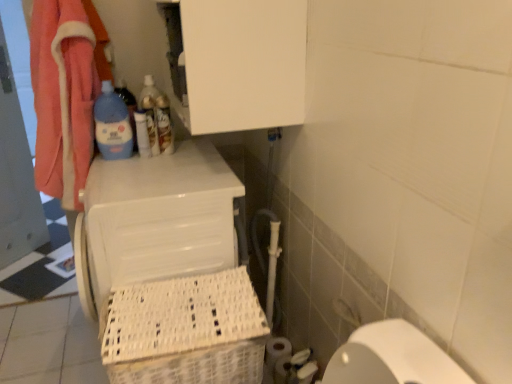
Question: Is white plastic basket at lower left in front of white plastic laundry basket at lower left?

Choices:
 (A) yes
 (B) no

Answer: (A)

Question: Could white plastic laundry basket at lower left be considered to be inside white plastic basket at lower left?

Choices:
 (A) no
 (B) yes

Answer: (A)

Question: Does white plastic basket at lower left turn towards white plastic laundry basket at lower left?

Choices:
 (A) no
 (B) yes

Answer: (A)

Question: Can you confirm if white plastic basket at lower left is shorter than white plastic laundry basket at lower left?

Choices:
 (A) no
 (B) yes

Answer: (B)

Question: Can you confirm if white plastic basket at lower left is positioned to the right of white plastic laundry basket at lower left?

Choices:
 (A) yes
 (B) no

Answer: (A)

Question: Is white plastic basket at lower left far from white plastic laundry basket at lower left?

Choices:
 (A) no
 (B) yes

Answer: (A)

Question: Does translucent plastic bottle at upper center, the 3th bottle in the left-to-right sequence, have a lesser width compared to white plastic laundry basket at lower left?

Choices:
 (A) no
 (B) yes

Answer: (B)

Question: Is translucent plastic bottle at upper center, positioned as the first bottle in right-to-left order, smaller than white plastic laundry basket at lower left?

Choices:
 (A) no
 (B) yes

Answer: (B)

Question: Can white plastic laundry basket at lower left be found inside translucent plastic bottle at upper center, the 3th bottle in the left-to-right sequence?

Choices:
 (A) no
 (B) yes

Answer: (A)

Question: Is translucent plastic bottle at upper center, positioned as the first bottle in right-to-left order, not close to white plastic laundry basket at lower left?

Choices:
 (A) no
 (B) yes

Answer: (A)

Question: Can you confirm if translucent plastic bottle at upper center, positioned as the first bottle in right-to-left order, is bigger than white plastic laundry basket at lower left?

Choices:
 (A) yes
 (B) no

Answer: (B)

Question: Does translucent plastic bottle at upper center, positioned as the first bottle in right-to-left order, have a greater height compared to white plastic laundry basket at lower left?

Choices:
 (A) no
 (B) yes

Answer: (A)

Question: Is white plastic laundry basket at lower left in front of white matte toilet paper at lower right, the third toilet paper viewed from the back?

Choices:
 (A) no
 (B) yes

Answer: (B)